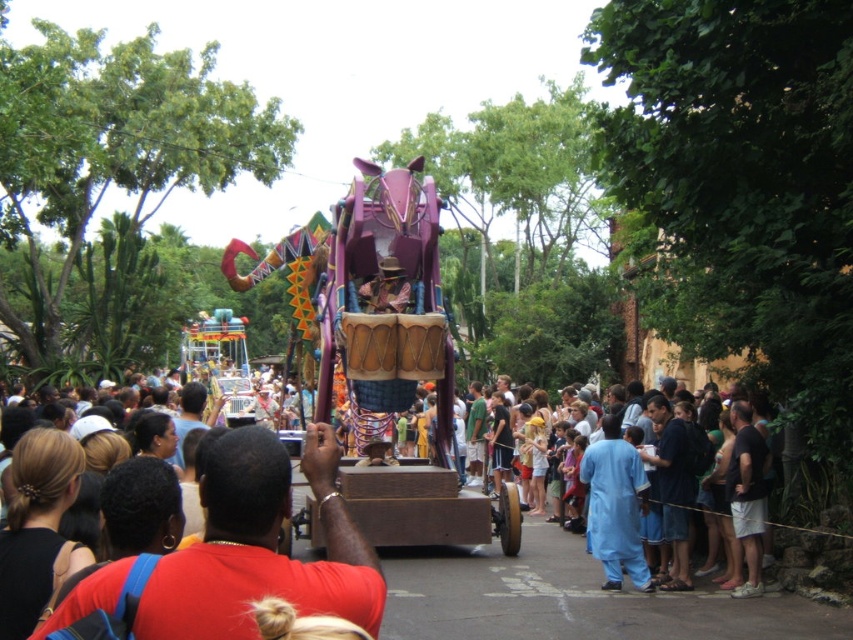
You are a photographer at the parade and want to capture the red matte shirt at center and blue cotton pants at center in a single frame. Which clothing item should you focus on to ensure both are visible without cropping?

The red matte shirt at center is wider than the blue cotton pants at center, so focusing on the red matte shirt at center will ensure both are visible without cropping.

You are standing in the crowd watching the parade float. You notice a person wearing a red matte shirt at center and blue cotton pants at center. Which piece of clothing is more visible to you?

The red matte shirt at center is closer to the viewer than the blue cotton pants at center, so the red matte shirt at center is more visible.

Where is the red matte shirt at center positioned in the image?

The red matte shirt at center is positioned at coordinates point [260,547].